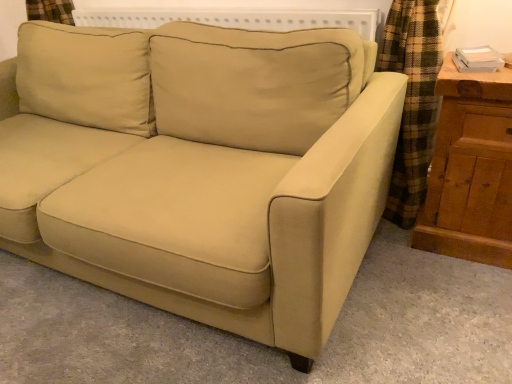
Find the location of a particular element. This screenshot has height=384, width=512. wooden dresser at right is located at coordinates (470, 170).

This screenshot has width=512, height=384. What do you see at coordinates (470, 170) in the screenshot?
I see `wooden dresser at right` at bounding box center [470, 170].

This screenshot has height=384, width=512. Describe the element at coordinates (217, 182) in the screenshot. I see `beige fabric couch at center` at that location.

The width and height of the screenshot is (512, 384). I want to click on beige fabric couch at center, so click(x=217, y=182).

Find the location of a particular element. wooden dresser at right is located at coordinates (470, 170).

Considering the relative positions of beige fabric couch at center and wooden dresser at right in the image provided, is beige fabric couch at center to the right of wooden dresser at right from the viewer's perspective?

No.

Which object is further away from the camera taking this photo, beige fabric couch at center or wooden dresser at right?

wooden dresser at right.

Is point (119, 235) in front of point (490, 79)?

That is True.

From the image's perspective, between beige fabric couch at center and wooden dresser at right, which one is located above?

beige fabric couch at center is shown above in the image.

From a real-world perspective, is beige fabric couch at center below wooden dresser at right?

Incorrect, from a real-world perspective, beige fabric couch at center is higher than wooden dresser at right.

In terms of width, does beige fabric couch at center look wider or thinner when compared to wooden dresser at right?

beige fabric couch at center is wider than wooden dresser at right.

From their relative heights in the image, would you say beige fabric couch at center is taller or shorter than wooden dresser at right?

Considering their sizes, beige fabric couch at center has more height than wooden dresser at right.

Does beige fabric couch at center have a smaller size compared to wooden dresser at right?

No, beige fabric couch at center is not smaller than wooden dresser at right.

Is wooden dresser at right located within beige fabric couch at center?

No, wooden dresser at right is not a part of beige fabric couch at center.

Is beige fabric couch at center positioned far away from wooden dresser at right?

No, there isn't a large distance between beige fabric couch at center and wooden dresser at right.

Consider the image. Does beige fabric couch at center turn towards wooden dresser at right?

No, beige fabric couch at center does not turn towards wooden dresser at right.

At what (x,y) coordinates should I click in order to perform the action: click on dresser below the beige fabric couch at center (from a real-world perspective). Please return your answer as a coordinate pair (x, y). Looking at the image, I should click on (470, 170).

Considering the relative positions of wooden dresser at right and beige fabric couch at center in the image provided, is wooden dresser at right to the left of beige fabric couch at center from the viewer's perspective?

In fact, wooden dresser at right is to the right of beige fabric couch at center.

Is the position of wooden dresser at right less distant than that of beige fabric couch at center?

That is False.

Which is in front, point (511, 263) or point (212, 91)?

The point (511, 263) is closer to the camera.

From the image's perspective, which is below, wooden dresser at right or beige fabric couch at center?

wooden dresser at right.

From a real-world perspective, is wooden dresser at right above or below beige fabric couch at center?

wooden dresser at right is situated lower than beige fabric couch at center in the real world.

Can you confirm if wooden dresser at right is thinner than beige fabric couch at center?

Yes, wooden dresser at right is thinner than beige fabric couch at center.

Considering the relative sizes of wooden dresser at right and beige fabric couch at center in the image provided, is wooden dresser at right shorter than beige fabric couch at center?

Correct, wooden dresser at right is not as tall as beige fabric couch at center.

Considering the sizes of objects wooden dresser at right and beige fabric couch at center in the image provided, who is bigger, wooden dresser at right or beige fabric couch at center?

Bigger between the two is beige fabric couch at center.

Is beige fabric couch at center a part of wooden dresser at right?

Actually, beige fabric couch at center is outside wooden dresser at right.

Is wooden dresser at right positioned far away from beige fabric couch at center?

They are positioned close to each other.

Is wooden dresser at right aimed at beige fabric couch at center?

No.

In the image, there is a beige fabric couch at center. Identify the location of dresser below it (from the image's perspective). The height and width of the screenshot is (384, 512). (470, 170).

The height and width of the screenshot is (384, 512). What are the coordinates of `dresser below the beige fabric couch at center (from a real-world perspective)` in the screenshot? It's located at (470, 170).

The image size is (512, 384). I want to click on studio couch above the wooden dresser at right (from a real-world perspective), so click(x=217, y=182).